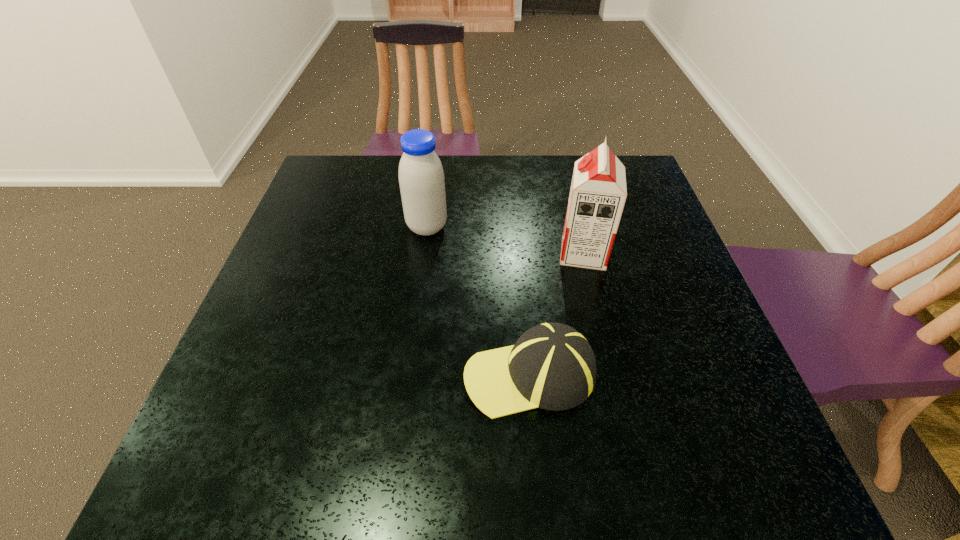
At what (x,y) coordinates should I click in order to perform the action: click on vacant area at the near edge. Please return your answer as a coordinate pair (x, y). The height and width of the screenshot is (540, 960). Looking at the image, I should click on (556, 444).

Find the location of a particular element. The image size is (960, 540). vacant space at the left edge is located at coordinates tap(316, 235).

Find the location of a particular element. free space at the right edge of the desktop is located at coordinates (682, 264).

The width and height of the screenshot is (960, 540). In the image, there is a desktop. Identify the location of vacant region at the far left corner. (341, 187).

In the image, there is a desktop. Where is `vacant space at the near left corner`? vacant space at the near left corner is located at coordinates (181, 494).

Image resolution: width=960 pixels, height=540 pixels. Find the location of `vacant space at the far right corner`. vacant space at the far right corner is located at coordinates (631, 160).

Where is `vacant area that lies between the left soya milk and the right soya milk`? vacant area that lies between the left soya milk and the right soya milk is located at coordinates (505, 240).

You are a GUI agent. You are given a task and a screenshot of the screen. Output one action in this format:
    pyautogui.click(x=<x>, y=<y>)
    Task: Click on the blank region between the nearest object and the right soya milk
    This screenshot has height=540, width=960.
    Given the screenshot: What is the action you would take?
    pyautogui.click(x=557, y=314)

Locate an element on the screen. This screenshot has height=540, width=960. free space between the right soya milk and the leftmost object is located at coordinates (505, 240).

Locate an element on the screen. The image size is (960, 540). free spot between the baseball cap and the right soya milk is located at coordinates (557, 314).